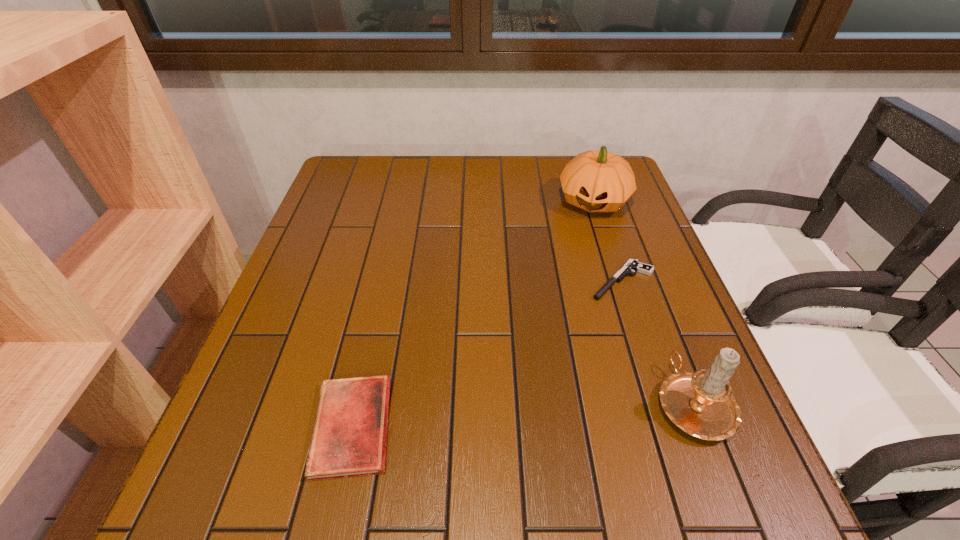
The width and height of the screenshot is (960, 540). In order to click on vacant space on the desktop that is between the leftmost object and the candle and is positioned on the front-facing side of the shortest object in this screenshot , I will do `click(495, 417)`.

The image size is (960, 540). Find the location of `vacant space on the desktop that is between the second shortest object and the candle and is positioned on the side of the gourd with the carved face`. vacant space on the desktop that is between the second shortest object and the candle and is positioned on the side of the gourd with the carved face is located at coordinates (534, 414).